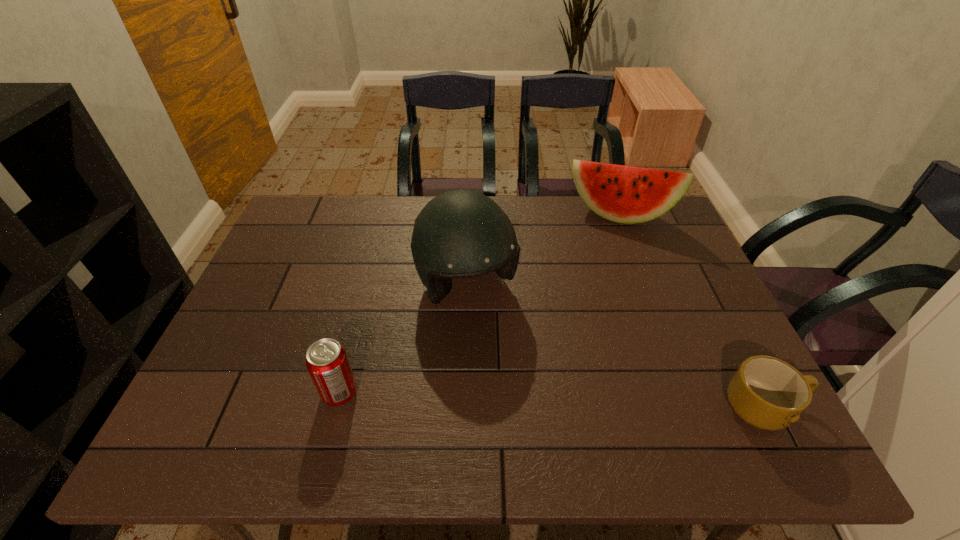
Identify the location of object present at the near right corner. (768, 393).

I want to click on vacant space at the far edge of the desktop, so click(x=548, y=204).

Locate an element on the screen. vacant space at the near edge of the desktop is located at coordinates (678, 397).

In the image, there is a desktop. Where is `free space at the left edge`? The width and height of the screenshot is (960, 540). free space at the left edge is located at coordinates coord(254,335).

Locate an element on the screen. This screenshot has width=960, height=540. empty location between the mug and the farthest object is located at coordinates (692, 312).

At what (x,y) coordinates should I click in order to perform the action: click on vacant region between the third nearest object and the farthest object. Please return your answer as a coordinate pair (x, y). Image resolution: width=960 pixels, height=540 pixels. Looking at the image, I should click on (543, 251).

The image size is (960, 540). I want to click on empty space between the mug and the farthest object, so click(x=692, y=312).

Locate an element on the screen. This screenshot has width=960, height=540. free spot between the shortest object and the watermelon is located at coordinates (692, 312).

Where is `free point between the second object from left to right and the watermelon`? This screenshot has width=960, height=540. free point between the second object from left to right and the watermelon is located at coordinates (543, 251).

Locate an element on the screen. This screenshot has height=540, width=960. vacant point located between the tallest object and the shortest object is located at coordinates (616, 347).